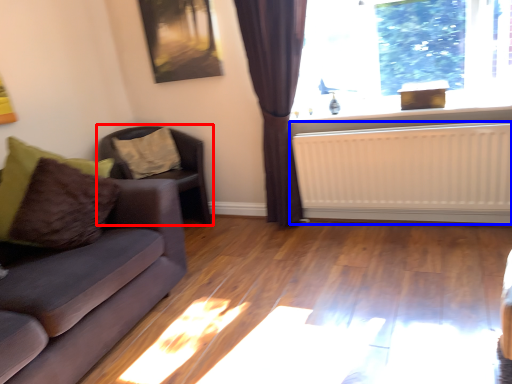
Question: Among these objects, which one is farthest to the camera, chair (highlighted by a red box) or radiator (highlighted by a blue box)?

Choices:
 (A) chair
 (B) radiator

Answer: (A)